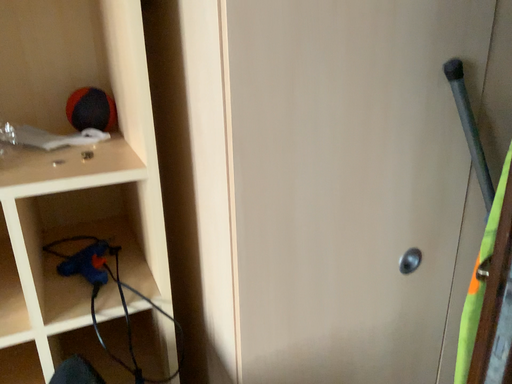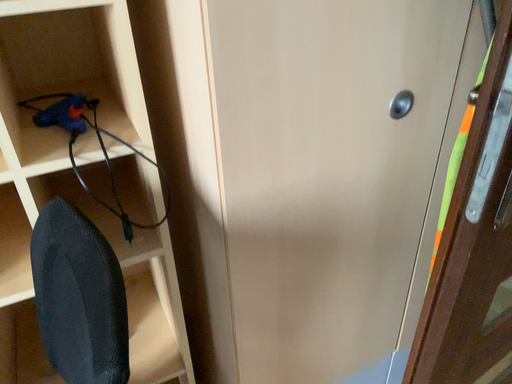
Question: How did the camera likely rotate when shooting the video?

Choices:
 (A) rotated downward
 (B) rotated upward

Answer: (A)